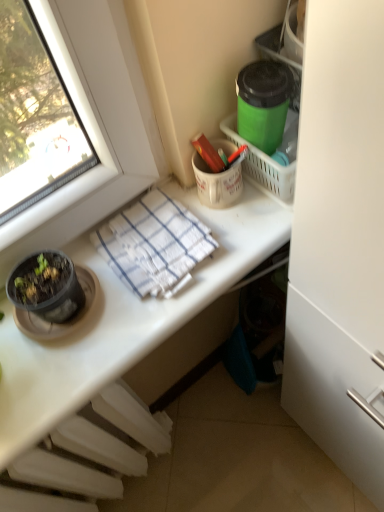
The height and width of the screenshot is (512, 384). Find the location of `white woven towel at center`. white woven towel at center is located at coordinates (154, 244).

What is the approximate width of green matte container at upper right?

It is 8.23 centimeters.

Locate an element on the screen. This screenshot has width=384, height=512. white woven towel at center is located at coordinates (154, 244).

Is there a large distance between white plastic radiator at lower left and green matte container at upper right?

No.

Considering the positions of points (99, 460) and (257, 140), is point (99, 460) farther from camera compared to point (257, 140)?

Yes, point (99, 460) is farther from viewer.

The width and height of the screenshot is (384, 512). I want to click on appliance that is above the white plastic radiator at lower left (from a real-world perspective), so click(263, 103).

Looking at their sizes, would you say white plastic radiator at lower left is wider or thinner than white woven towel at center?

white plastic radiator at lower left is thinner than white woven towel at center.

Identify the location of blanket that is above the white plastic radiator at lower left (from the image's perspective). This screenshot has width=384, height=512. (154, 244).

How distant is white plastic radiator at lower left from white woven towel at center?

white plastic radiator at lower left and white woven towel at center are 38.78 centimeters apart from each other.

Is white plastic radiator at lower left bigger or smaller than white woven towel at center?

white plastic radiator at lower left is bigger than white woven towel at center.

Is green matte container at upper right not near white glossy desk at upper center?

No, there isn't a large distance between green matte container at upper right and white glossy desk at upper center.

How distant is green matte container at upper right from white glossy desk at upper center?

→ green matte container at upper right and white glossy desk at upper center are 28.36 centimeters apart.

Consider the image. Is green matte container at upper right wider than white glossy desk at upper center?

No, green matte container at upper right is not wider than white glossy desk at upper center.

From the image's perspective, is green matte container at upper right under white glossy desk at upper center?

No, from the image's perspective, green matte container at upper right is not beneath white glossy desk at upper center.

From the image's perspective, is white glossy desk at upper center located above white woven towel at center?

No.

In the image, is white glossy desk at upper center on the left side or the right side of white woven towel at center?

In the image, white glossy desk at upper center appears on the left side of white woven towel at center.

Is white glossy desk at upper center in front of or behind white woven towel at center in the image?

white glossy desk at upper center is positioned closer to the viewer than white woven towel at center.

Can you tell me how much white glossy desk at upper center and white woven towel at center differ in facing direction?

0.000687 degrees separate the facing orientations of white glossy desk at upper center and white woven towel at center.

Considering their positions, is green matte container at upper right located in front of or behind white plastic radiator at lower left?

green matte container at upper right is in front of white plastic radiator at lower left.

Is green matte container at upper right placed right next to white plastic radiator at lower left?

There is a gap between green matte container at upper right and white plastic radiator at lower left.

Identify the location of radiator below the green matte container at upper right (from the image's perspective). (87, 456).

Is green matte container at upper right outside of white plastic radiator at lower left?

Yes.

Considering the positions of objects green matte container at upper right and white woven towel at center in the image provided, who is in front, green matte container at upper right or white woven towel at center?

green matte container at upper right.

Considering the sizes of objects green matte container at upper right and white woven towel at center in the image provided, who is taller, green matte container at upper right or white woven towel at center?

green matte container at upper right is taller.

In terms of size, does green matte container at upper right appear bigger or smaller than white woven towel at center?

In the image, green matte container at upper right appears to be smaller than white woven towel at center.

From a real-world perspective, relative to white woven towel at center, is green matte container at upper right vertically above or below?

green matte container at upper right is situated higher than white woven towel at center in the real world.

Does point (154, 233) appear closer or farther from the camera than point (286, 102)?

Point (154, 233) appears to be farther away from the viewer than point (286, 102).

From the image's perspective, which object appears higher, white woven towel at center or green matte container at upper right?

green matte container at upper right, from the image's perspective.

Can you confirm if white woven towel at center is thinner than green matte container at upper right?

In fact, white woven towel at center might be wider than green matte container at upper right.

You are a GUI agent. You are given a task and a screenshot of the screen. Output one action in this format:
    pyautogui.click(x=<x>, y=<y>)
    Task: Click on the appliance in front of the white plastic radiator at lower left
    
    Given the screenshot: What is the action you would take?
    pyautogui.click(x=263, y=103)

Locate an element on the screen. radiator that is under the white woven towel at center (from a real-world perspective) is located at coordinates (87, 456).

From the image, which object appears to be farther from white glossy desk at upper center, white woven towel at center or green matte container at upper right?

Based on the image, green matte container at upper right appears to be further to white glossy desk at upper center.

Based on their spatial positions, is green matte container at upper right or white woven towel at center further from white plastic radiator at lower left?

Based on the image, green matte container at upper right appears to be further to white plastic radiator at lower left.

Consider the image. Looking at the image, which one is located closer to white glossy desk at upper center, green matte container at upper right or white plastic radiator at lower left?

The object closer to white glossy desk at upper center is white plastic radiator at lower left.

Looking at the image, which one is located further to white glossy desk at upper center, white plastic radiator at lower left or green matte container at upper right?

green matte container at upper right is further to white glossy desk at upper center.

Estimate the real-world distances between objects in this image. Which object is closer to white glossy desk at upper center, white plastic radiator at lower left or white woven towel at center?

Based on the image, white woven towel at center appears to be nearer to white glossy desk at upper center.

Estimate the real-world distances between objects in this image. Which object is closer to white woven towel at center, green matte container at upper right or white glossy desk at upper center?

white glossy desk at upper center lies closer to white woven towel at center than the other object.

Which object lies nearer to the anchor point green matte container at upper right, white woven towel at center or white plastic radiator at lower left?

white woven towel at center lies closer to green matte container at upper right than the other object.

Based on their spatial positions, is white glossy desk at upper center or white woven towel at center further from green matte container at upper right?

white glossy desk at upper center is further to green matte container at upper right.

Identify the location of desk between green matte container at upper right and white plastic radiator at lower left in the vertical direction. This screenshot has width=384, height=512. (123, 321).

The width and height of the screenshot is (384, 512). What are the coordinates of `blanket between green matte container at upper right and white plastic radiator at lower left vertically` in the screenshot? It's located at (154, 244).

At what (x,y) coordinates should I click in order to perform the action: click on blanket that lies between green matte container at upper right and white glossy desk at upper center from top to bottom. Please return your answer as a coordinate pair (x, y). This screenshot has width=384, height=512. Looking at the image, I should click on (154, 244).

This screenshot has height=512, width=384. I want to click on desk that lies between white woven towel at center and white plastic radiator at lower left from top to bottom, so click(x=123, y=321).